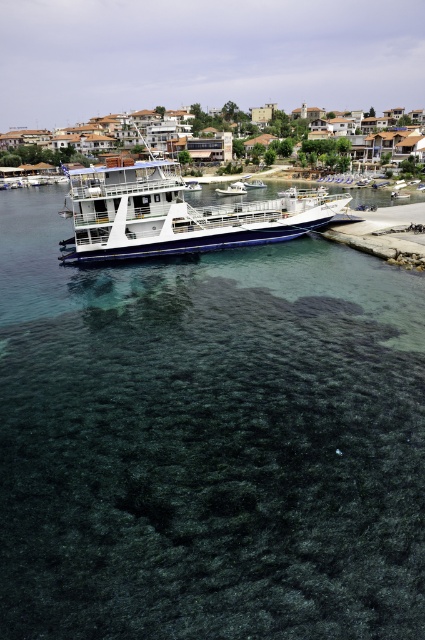
Between white glossy cruise ship at center and white glossy boat at center, which one appears on the left side from the viewer's perspective?

From the viewer's perspective, white glossy boat at center appears more on the left side.

Can you confirm if white glossy cruise ship at center is positioned to the left of white glossy boat at center?

Incorrect, white glossy cruise ship at center is not on the left side of white glossy boat at center.

The image size is (425, 640). Identify the location of white glossy cruise ship at center. (175, 214).

Which of these two, clear glass water at center or white glossy cruise ship at center, stands taller?

With more height is white glossy cruise ship at center.

Does clear glass water at center appear over white glossy cruise ship at center?

No.

Find the location of `clear glass water at center`. clear glass water at center is located at coordinates (207, 442).

Consider the image. Is clear glass water at center shorter than white glossy boat at center?

In fact, clear glass water at center may be taller than white glossy boat at center.

Is point (2, 413) positioned behind point (232, 182)?

That is False.

Does point (300, 508) come farther from viewer compared to point (232, 184)?

No, (300, 508) is in front of (232, 184).

Image resolution: width=425 pixels, height=640 pixels. Identify the location of clear glass water at center. (207, 442).